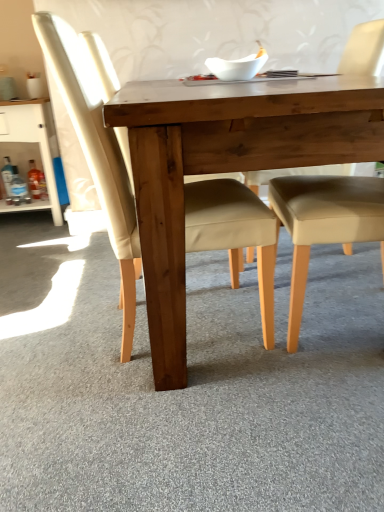
Question: Is white glossy cabinet at left completely or partially inside matte wood chair at center, placed as the second chair when sorted from right to left?

Choices:
 (A) yes
 (B) no

Answer: (B)

Question: Can you confirm if matte wood chair at center, placed as the second chair when sorted from right to left, is smaller than white glossy cabinet at left?

Choices:
 (A) yes
 (B) no

Answer: (B)

Question: From the image's perspective, is matte wood chair at center, placed as the second chair when sorted from right to left, located beneath white glossy cabinet at left?

Choices:
 (A) yes
 (B) no

Answer: (A)

Question: From the image's perspective, is matte wood chair at center, which is the 1th chair from left to right, above white glossy cabinet at left?

Choices:
 (A) yes
 (B) no

Answer: (B)

Question: Is matte wood chair at center, which is the 1th chair from left to right, next to white glossy cabinet at left?

Choices:
 (A) no
 (B) yes

Answer: (A)

Question: In the image, is white glossy cabinet at left positioned in front of or behind beige leather chair at center, marked as the second chair in a left-to-right arrangement?

Choices:
 (A) behind
 (B) front

Answer: (A)

Question: Is white glossy cabinet at left inside or outside of beige leather chair at center, acting as the first chair starting from the right?

Choices:
 (A) inside
 (B) outside

Answer: (B)

Question: From a real-world perspective, is white glossy cabinet at left above or below beige leather chair at center, marked as the second chair in a left-to-right arrangement?

Choices:
 (A) above
 (B) below

Answer: (B)

Question: From the image's perspective, relative to beige leather chair at center, acting as the first chair starting from the right, is white glossy cabinet at left above or below?

Choices:
 (A) below
 (B) above

Answer: (B)

Question: From a real-world perspective, relative to matte wood chair at center, which is the 1th chair from left to right, is natural wood table at center vertically above or below?

Choices:
 (A) above
 (B) below

Answer: (B)

Question: From the image's perspective, is natural wood table at center positioned above or below matte wood chair at center, which is the 1th chair from left to right?

Choices:
 (A) above
 (B) below

Answer: (A)

Question: Do you think natural wood table at center is within matte wood chair at center, which is the 1th chair from left to right, or outside of it?

Choices:
 (A) inside
 (B) outside

Answer: (B)

Question: Relative to matte wood chair at center, which is the 1th chair from left to right, is natural wood table at center in front or behind?

Choices:
 (A) behind
 (B) front

Answer: (B)

Question: Is white glossy cabinet at left spatially inside matte wood chair at center, which is the 1th chair from left to right, or outside of it?

Choices:
 (A) outside
 (B) inside

Answer: (A)

Question: In terms of width, does white glossy cabinet at left look wider or thinner when compared to matte wood chair at center, which is the 1th chair from left to right?

Choices:
 (A) wide
 (B) thin

Answer: (B)